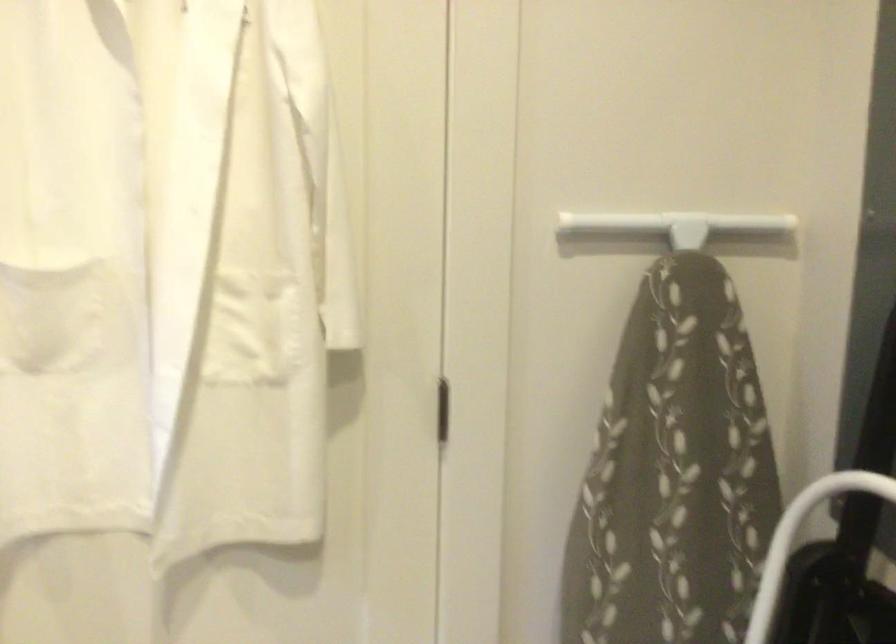
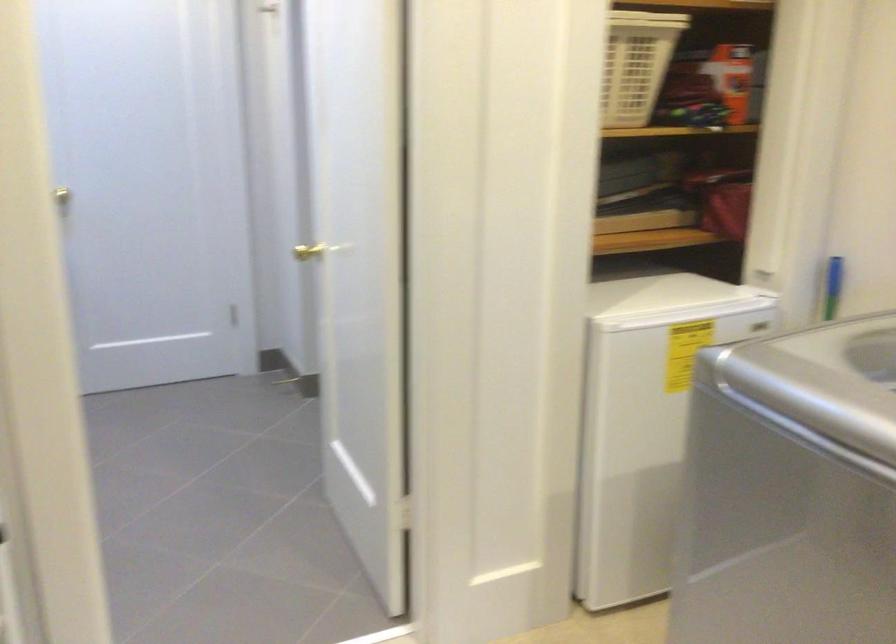
How did the camera likely rotate?

The rotation direction of the camera is right-down.